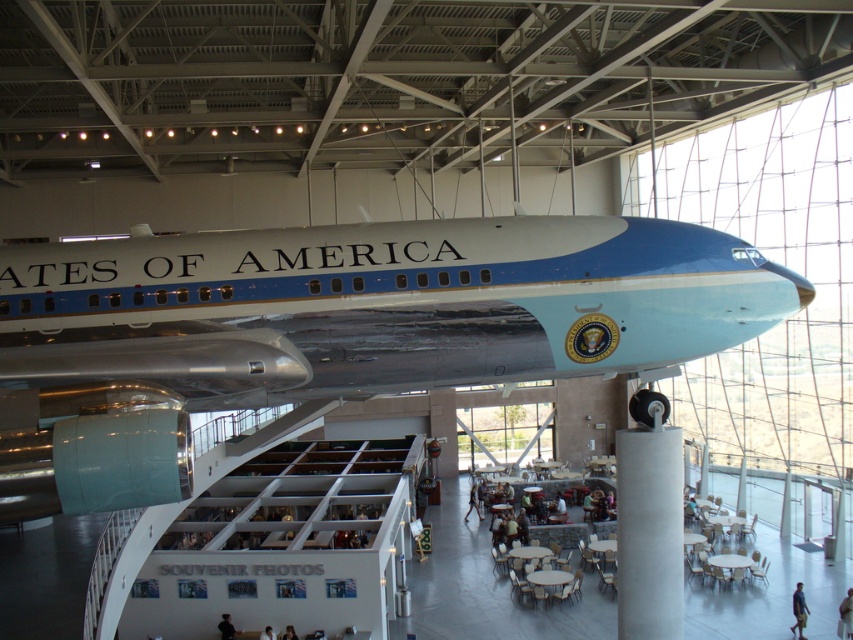
You are standing in the museum facing the Boeing 707 display. There are blue jeans at lower right. Where would you look to find the blue jeans?

The blue jeans at lower right are located at the 2D coordinates point (799, 609), which is near the bottom right corner of the display area.

You are a tour guide in the museum and need to ensure that visitors can comfortably walk around the black fabric person at lower center and the light brown hair at lower center. Given that the minimum recommended distance between visitors is 3 feet for safety, is the current spacing between these two individuals sufficient?

The distance between the black fabric person at lower center and the light brown hair at lower center is 4.28 feet, which exceeds the minimum recommended 3 feet for safety. Therefore, the current spacing is sufficient.